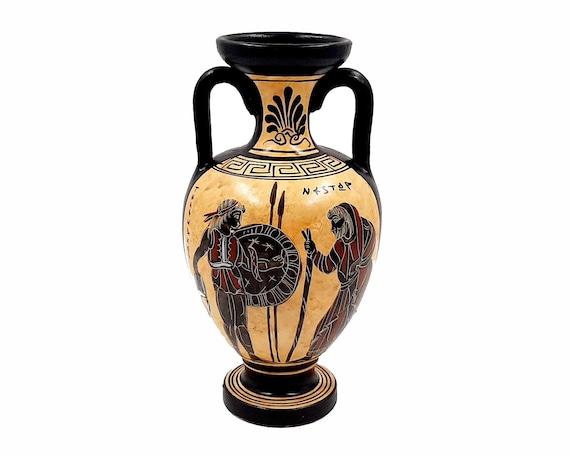
At what (x,y) coordinates should I click in order to perform the action: click on left handle. Please return your answer as a coordinate pair (x, y). This screenshot has height=456, width=570. Looking at the image, I should click on (209, 95).